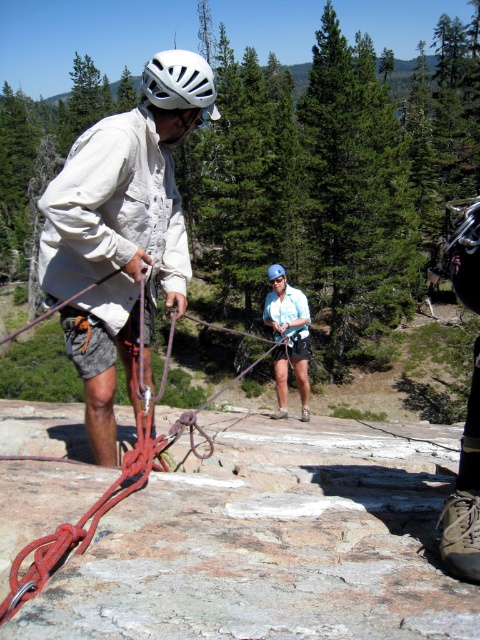
Question: Which is nearer to the white matte helmet at center?

Choices:
 (A) red synthetic rope at center
 (B) white matte helmet at upper center
 (C) blue fabric shirt at center

Answer: (B)

Question: Does blue fabric shirt at center appear on the right side of white matte helmet at upper center?

Choices:
 (A) no
 (B) yes

Answer: (B)

Question: Which of the following is the farthest from the observer?

Choices:
 (A) blue fabric shirt at center
 (B) red synthetic rope at center
 (C) white matte helmet at upper center

Answer: (A)

Question: Estimate the real-world distances between objects in this image. Which object is farther from the white matte helmet at upper center?

Choices:
 (A) white matte helmet at center
 (B) red synthetic rope at center

Answer: (B)

Question: In this image, where is white matte helmet at center located relative to white matte helmet at upper center?

Choices:
 (A) left
 (B) right

Answer: (A)

Question: Does red synthetic rope at center come in front of blue fabric shirt at center?

Choices:
 (A) no
 (B) yes

Answer: (B)